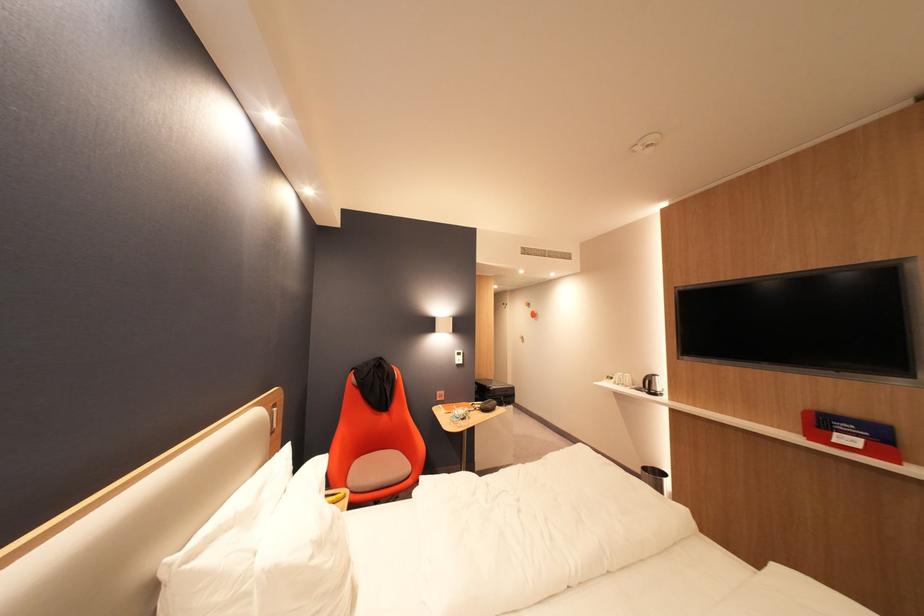
This screenshot has height=616, width=924. Find the location of `black electric kettle`. black electric kettle is located at coordinates (651, 384).